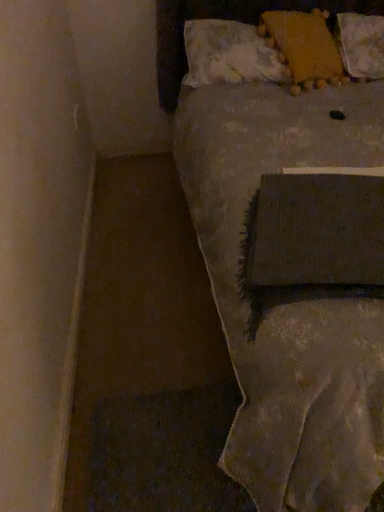
Question: Is textured gray blanket at center wider than fluffy yellow pillow at upper right, the 3th pillow when ordered from left to right?

Choices:
 (A) no
 (B) yes

Answer: (B)

Question: Is textured gray blanket at center turned away from fluffy yellow pillow at upper right, acting as the first pillow starting from the right?

Choices:
 (A) no
 (B) yes

Answer: (B)

Question: From a real-world perspective, is textured gray blanket at center below fluffy yellow pillow at upper right, acting as the first pillow starting from the right?

Choices:
 (A) no
 (B) yes

Answer: (B)

Question: Is textured gray blanket at center taller than fluffy yellow pillow at upper right, acting as the first pillow starting from the right?

Choices:
 (A) no
 (B) yes

Answer: (B)

Question: From the image's perspective, is textured gray blanket at center on fluffy yellow pillow at upper right, acting as the first pillow starting from the right?

Choices:
 (A) no
 (B) yes

Answer: (A)

Question: Is textured gray blanket at center positioned behind fluffy yellow pillow at upper right, acting as the first pillow starting from the right?

Choices:
 (A) no
 (B) yes

Answer: (A)

Question: Does fluffy yellow pillow at upper right, acting as the first pillow starting from the right, appear on the left side of textured gray blanket at center?

Choices:
 (A) no
 (B) yes

Answer: (A)

Question: Is fluffy yellow pillow at upper right, acting as the first pillow starting from the right, wider than textured gray blanket at center?

Choices:
 (A) no
 (B) yes

Answer: (A)

Question: Is fluffy yellow pillow at upper right, acting as the first pillow starting from the right, directly adjacent to textured gray blanket at center?

Choices:
 (A) yes
 (B) no

Answer: (B)

Question: Is fluffy yellow pillow at upper right, the 3th pillow when ordered from left to right, closer to the viewer compared to textured gray blanket at center?

Choices:
 (A) yes
 (B) no

Answer: (B)

Question: Can you confirm if fluffy yellow pillow at upper right, the 3th pillow when ordered from left to right, is positioned to the right of textured gray blanket at center?

Choices:
 (A) yes
 (B) no

Answer: (A)

Question: Is fluffy yellow pillow at upper right, the 3th pillow when ordered from left to right, far away from textured gray blanket at center?

Choices:
 (A) yes
 (B) no

Answer: (B)

Question: From a real-world perspective, is textured gray blanket at center below yellow fabric pillow at upper right, the first pillow from the left?

Choices:
 (A) no
 (B) yes

Answer: (B)